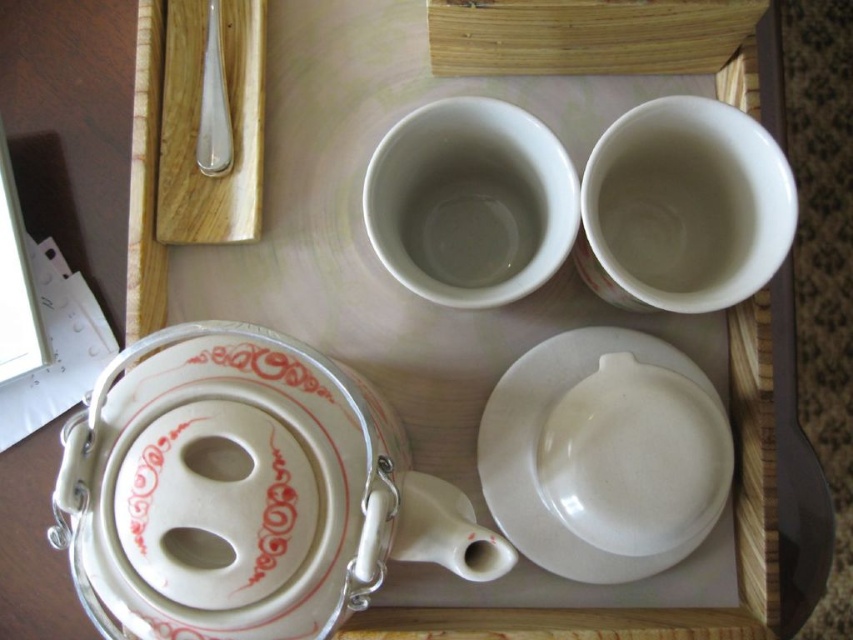
Question: Does white glossy teapot at bottom left have a larger size compared to white glossy platter at center?

Choices:
 (A) no
 (B) yes

Answer: (B)

Question: Which point is closer to the camera?

Choices:
 (A) white glossy platter at center
 (B) white glossy teapot at bottom left

Answer: (B)

Question: Which point is closer to the camera?

Choices:
 (A) white glossy platter at center
 (B) white glossy teapot at bottom left

Answer: (B)

Question: Does white glossy teapot at bottom left appear on the left side of white glossy platter at center?

Choices:
 (A) yes
 (B) no

Answer: (A)

Question: Can you confirm if white glossy teapot at bottom left is positioned below white glossy platter at center?

Choices:
 (A) no
 (B) yes

Answer: (B)